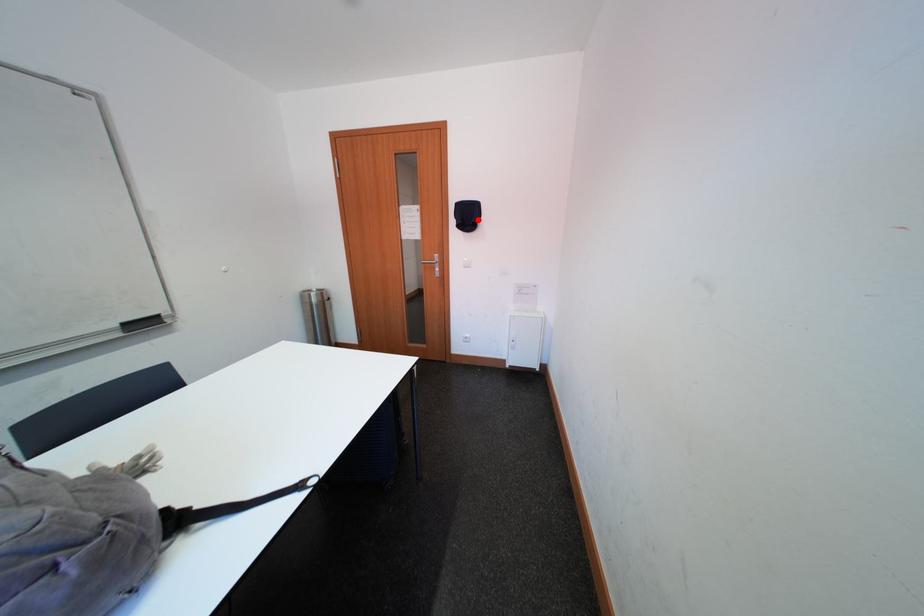
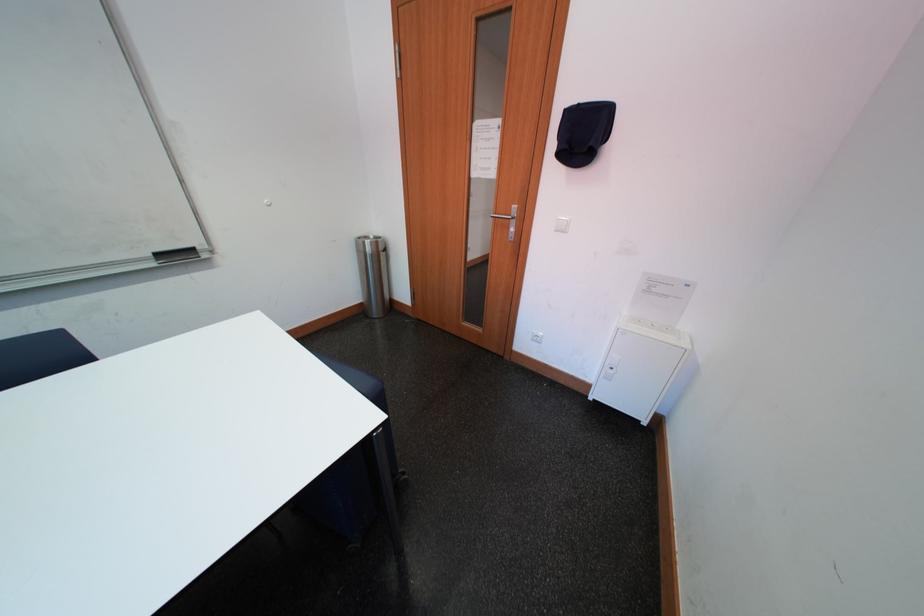
In the second image, find the point that corresponds to the highlighted location in the first image.

(593, 140)